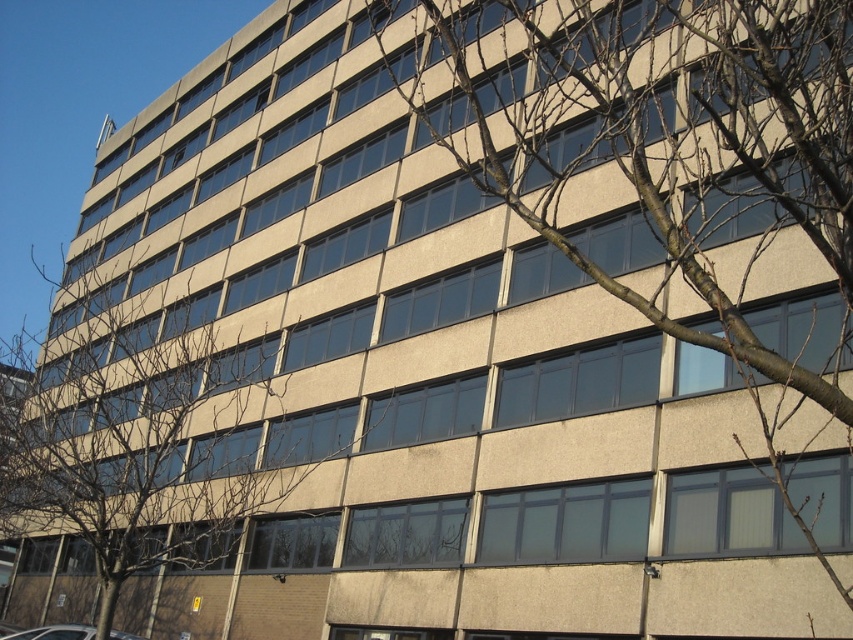
Can you confirm if gray concrete building at center is positioned to the right of bare branches at center?

Yes, gray concrete building at center is to the right of bare branches at center.

Find the location of a particular element. This screenshot has height=640, width=853. gray concrete building at center is located at coordinates (669, 147).

Can you confirm if gray concrete building at center is positioned to the left of white glossy car at lower left?

In fact, gray concrete building at center is to the right of white glossy car at lower left.

Between point (544, 230) and point (10, 634), which one is positioned behind?

Positioned behind is point (10, 634).

Which is behind, point (819, 108) or point (20, 634)?

Positioned behind is point (20, 634).

This screenshot has height=640, width=853. Find the location of `gray concrete building at center`. gray concrete building at center is located at coordinates (669, 147).

Who is taller, bare branches at center or white glossy car at lower left?

bare branches at center

Is bare branches at center below white glossy car at lower left?

No.

Who is more distant from viewer, (x=41, y=384) or (x=62, y=637)?

Positioned behind is point (x=41, y=384).

Find the location of a particular element. Image resolution: width=853 pixels, height=640 pixels. bare branches at center is located at coordinates (136, 445).